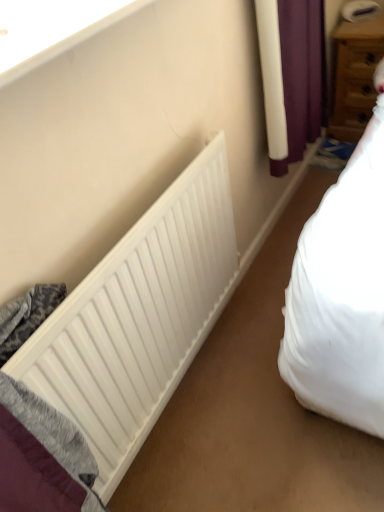
At what (x,y) coordinates should I click in order to perform the action: click on free spot below white matte radiator at lower left (from a real-world perspective). Please return your answer as a coordinate pair (x, y). Looking at the image, I should click on (188, 381).